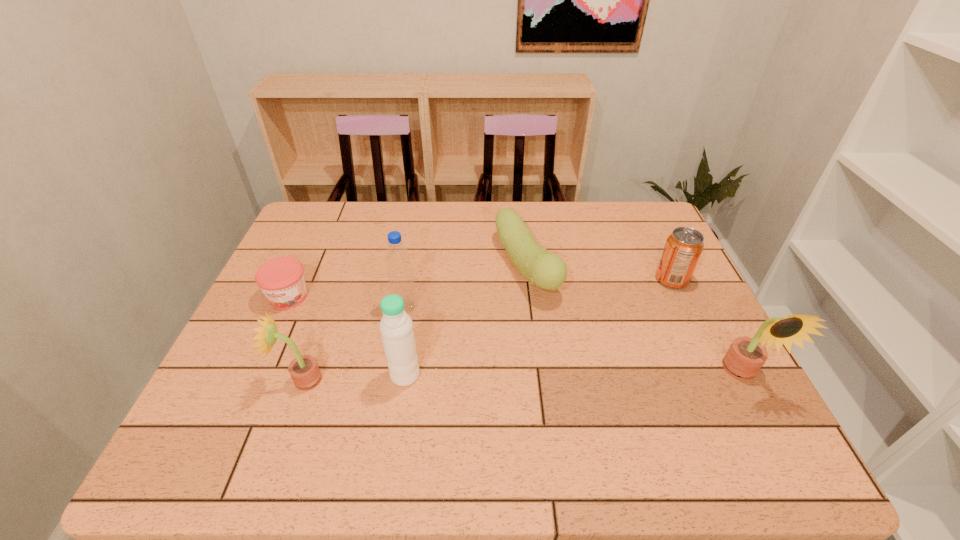
You are a GUI agent. You are given a task and a screenshot of the screen. Output one action in this format:
    pyautogui.click(x=<x>, y=<y>)
    Task: Click on the sunflower located at the left edge
    The image size is (960, 540).
    Given the screenshot: What is the action you would take?
    pyautogui.click(x=304, y=370)

You are a GUI agent. You are given a task and a screenshot of the screen. Output one action in this format:
    pyautogui.click(x=<x>, y=<y>)
    Task: Click on the jam positioned at the left edge
    
    Given the screenshot: What is the action you would take?
    pyautogui.click(x=281, y=279)

This screenshot has width=960, height=540. I want to click on sunflower that is at the right edge, so pyautogui.click(x=745, y=357).

The height and width of the screenshot is (540, 960). Identify the location of soda can that is at the right edge. (684, 246).

At what (x,y) coordinates should I click in order to perform the action: click on object located in the near left corner section of the desktop. Please return your answer as a coordinate pair (x, y). Looking at the image, I should click on (304, 370).

Locate an element on the screen. The width and height of the screenshot is (960, 540). object that is at the near right corner is located at coordinates tap(745, 357).

Image resolution: width=960 pixels, height=540 pixels. Identify the location of vacant space at the far edge of the desktop. (496, 210).

Identify the location of free region at the left edge. The width and height of the screenshot is (960, 540). (311, 272).

I want to click on free space at the right edge of the desktop, so click(695, 296).

You are a GUI agent. You are given a task and a screenshot of the screen. Output one action in this format:
    pyautogui.click(x=<x>, y=<y>)
    Task: Click on the free space at the near left corner of the desktop
    Image resolution: width=960 pixels, height=540 pixels.
    Given the screenshot: What is the action you would take?
    pyautogui.click(x=246, y=411)